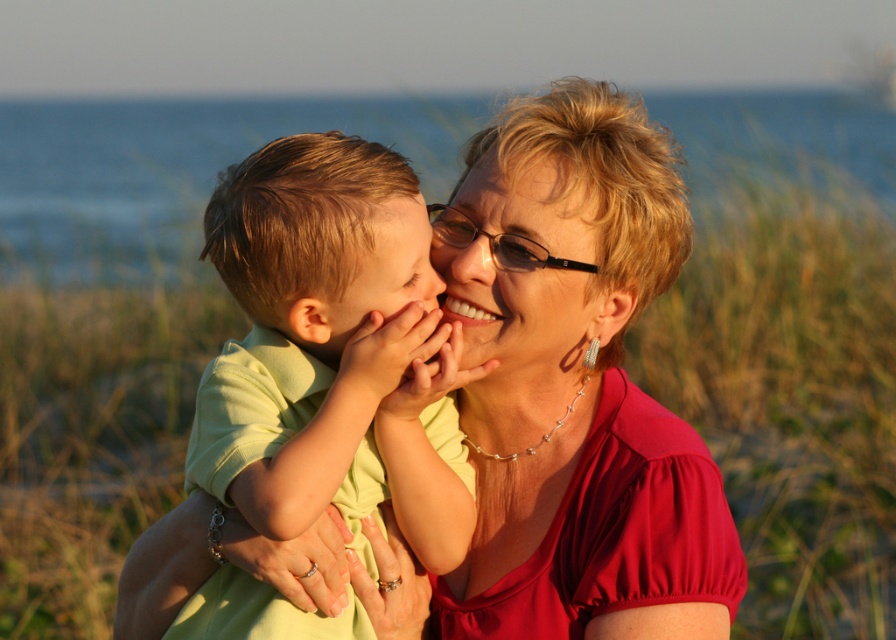
Identify the location of matte black glasses at center. (523, 272).

Does matte black glasses at center have a smaller size compared to smooth skin face at center?

No.

Who is more distant from viewer, (x=457, y=237) or (x=411, y=282)?

Point (x=457, y=237)

Find the location of a particular element. matte black glasses at center is located at coordinates (523, 272).

Which is in front, point (178, 154) or point (418, 211)?

Point (418, 211)

Does blue water at upper center lie behind smooth skin face at center?

Yes, blue water at upper center is behind smooth skin face at center.

Who is more distant from viewer, [36,145] or [421,236]?

The point [36,145] is more distant.

Locate an element on the screen. blue water at upper center is located at coordinates (175, 170).

Is light green cotton shirt at center bigger than smooth blonde hair at upper center?

Yes, light green cotton shirt at center is bigger than smooth blonde hair at upper center.

Does light green cotton shirt at center have a lesser height compared to smooth blonde hair at upper center?

No, light green cotton shirt at center is not shorter than smooth blonde hair at upper center.

The image size is (896, 640). Describe the element at coordinates (326, 342) in the screenshot. I see `light green cotton shirt at center` at that location.

Locate an element on the screen. Image resolution: width=896 pixels, height=640 pixels. light green cotton shirt at center is located at coordinates (326, 342).